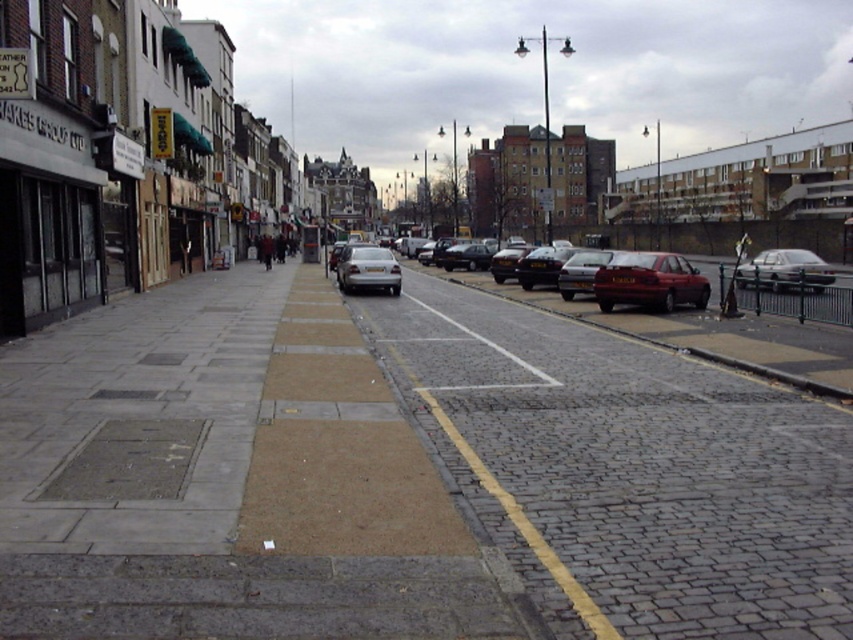
Who is more distant from viewer, (503, 374) or (361, 285)?

Point (361, 285)

Between point (689, 493) and point (347, 268), which one is positioned in front?

Point (689, 493) is in front.

Who is more distant from viewer, (795, 428) or (381, 268)?

The point (381, 268) is more distant.

Image resolution: width=853 pixels, height=640 pixels. I want to click on brick paved road at center, so click(628, 470).

Can you confirm if silver metallic sedan at center-right is positioned below shiny silver car at center?

Incorrect, silver metallic sedan at center-right is not positioned below shiny silver car at center.

The image size is (853, 640). What do you see at coordinates (581, 272) in the screenshot?
I see `silver metallic sedan at center-right` at bounding box center [581, 272].

I want to click on silver metallic sedan at center-right, so click(581, 272).

Consider the image. Can you confirm if matte red car at center is positioned to the right of silver metallic sedan at center?

Incorrect, matte red car at center is not on the right side of silver metallic sedan at center.

Is matte red car at center closer to camera compared to silver metallic sedan at center?

Yes, matte red car at center is in front of silver metallic sedan at center.

Locate an element on the screen. This screenshot has width=853, height=640. matte red car at center is located at coordinates (648, 282).